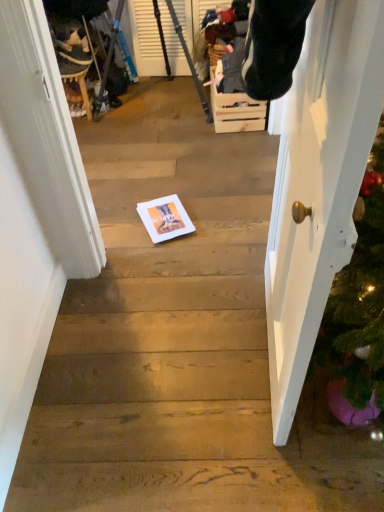
This screenshot has width=384, height=512. Identify the location of vacant space that is to the left of white paper at center. (116, 226).